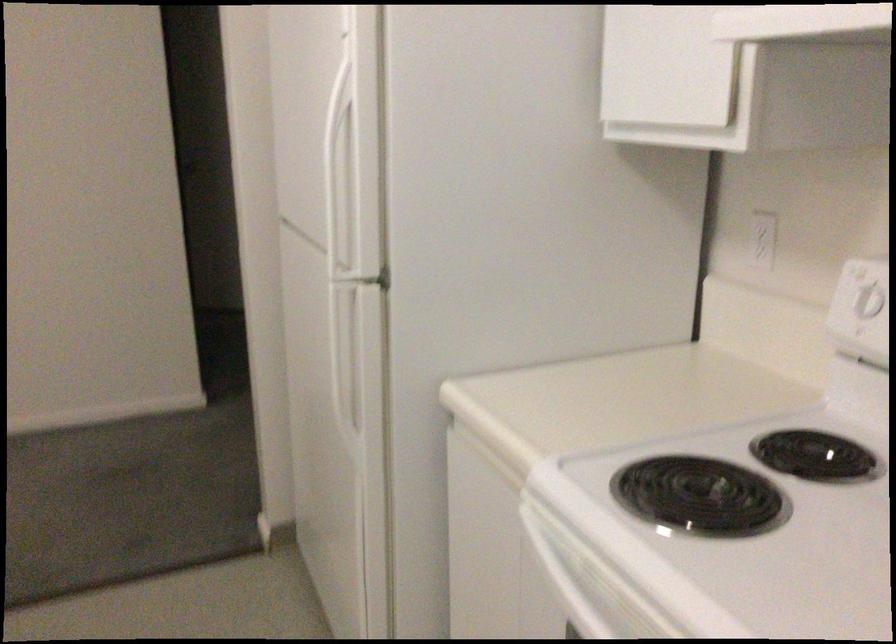
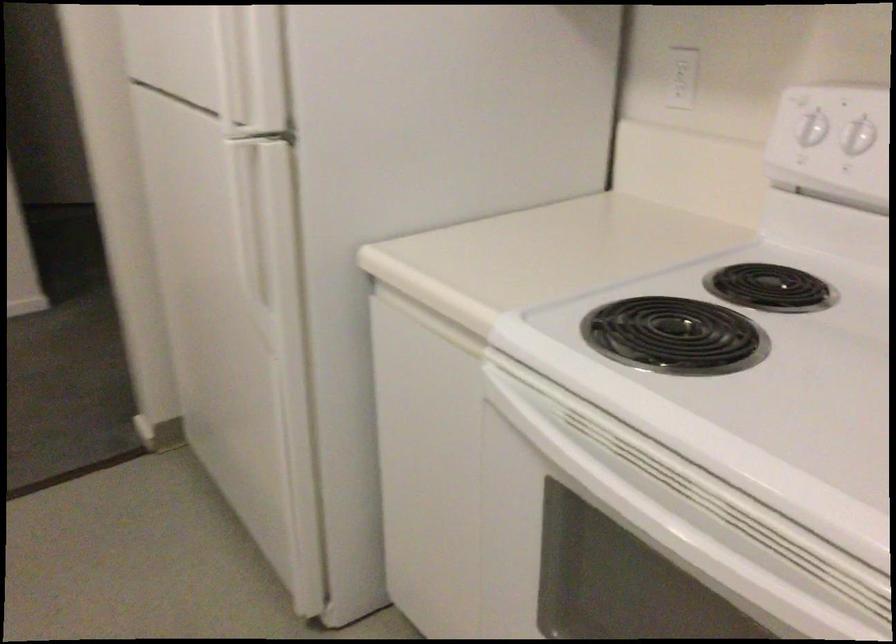
In a continuous first-person perspective shot, in which direction is the camera moving?

The cameraman walked toward left, forward.